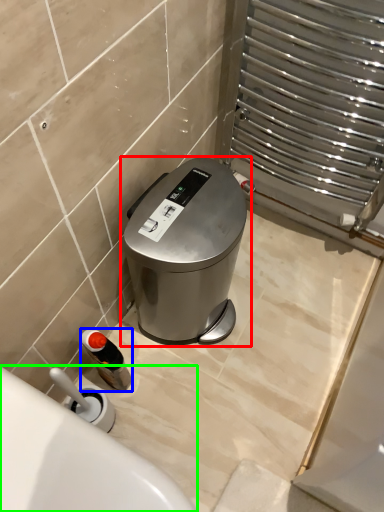
Question: Which is nearer to the waste container (highlighted by a red box)? bottle (highlighted by a blue box) or bath (highlighted by a green box).

Choices:
 (A) bottle
 (B) bath

Answer: (A)